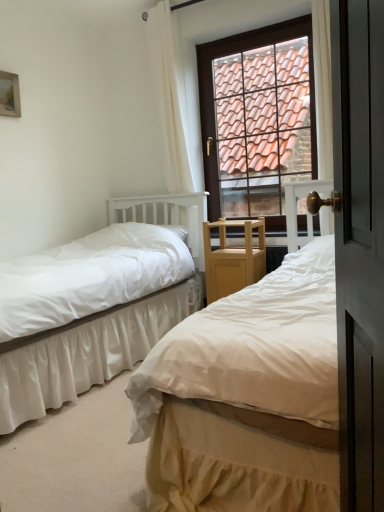
Question: From a real-world perspective, is brown tile roof at upper center physically located above or below white sheer curtain at upper center?

Choices:
 (A) below
 (B) above

Answer: (A)

Question: In the image, is brown tile roof at upper center positioned in front of or behind white sheer curtain at upper center?

Choices:
 (A) front
 (B) behind

Answer: (A)

Question: Which object is the closest to the white sheer curtain at upper center?

Choices:
 (A) white satin bed at center, which is the first bed from left to right
 (B) white cotton bed at center, arranged as the 1th bed when viewed from the right
 (C) matte white screen door at right
 (D) wooden picture frame at upper left
 (E) brown tile roof at upper center

Answer: (E)

Question: Estimate the real-world distances between objects in this image. Which object is farther from the white satin bed at center, which is counted as the second bed, starting from the right?

Choices:
 (A) white cotton bed at center, arranged as the 1th bed when viewed from the right
 (B) white sheer curtain at upper center
 (C) wooden picture frame at upper left
 (D) brown tile roof at upper center
 (E) matte white screen door at right

Answer: (E)